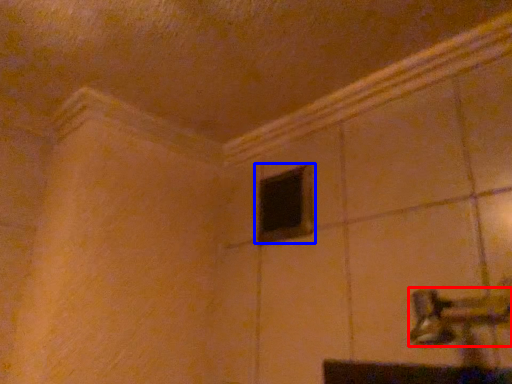
Question: Among these objects, which one is farthest to the camera, door handle (highlighted by a red box) or window (highlighted by a blue box)?

Choices:
 (A) door handle
 (B) window

Answer: (B)